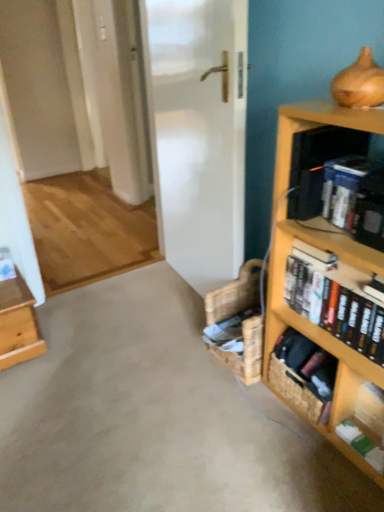
Where is `free space in front of green matte book at lower right, placed as the third book when sorted from top to bottom`? This screenshot has width=384, height=512. free space in front of green matte book at lower right, placed as the third book when sorted from top to bottom is located at coordinates pos(364,489).